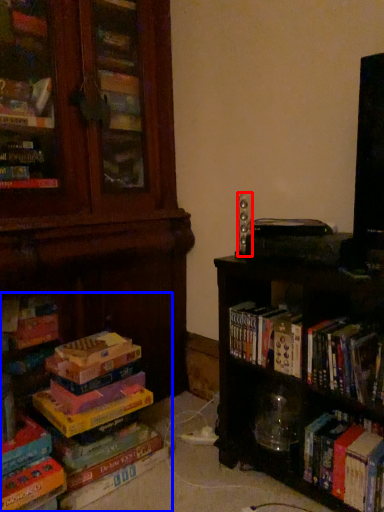
Question: Which point is closer to the camera, speaker (highlighted by a red box) or book (highlighted by a blue box)?

Choices:
 (A) speaker
 (B) book

Answer: (B)